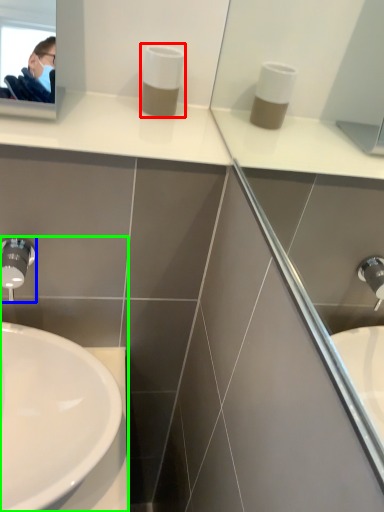
Question: Which object is the farthest from soap dispenser (highlighted by a red box)? Choose among these: tap (highlighted by a blue box) or sink (highlighted by a green box).

Choices:
 (A) tap
 (B) sink

Answer: (B)